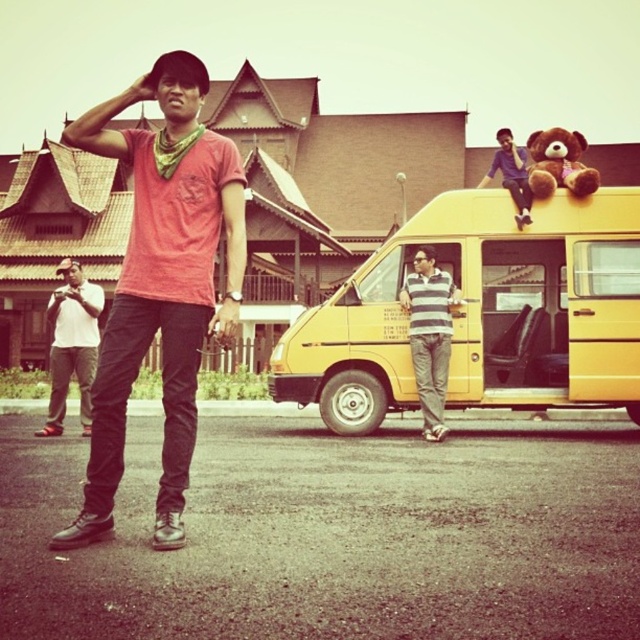
Does point (115, 349) lie behind point (534, 170)?

That is False.

Which is above, matte red t-shirt at center or brown plush bear at upper right?

Positioned higher is brown plush bear at upper right.

The width and height of the screenshot is (640, 640). Describe the element at coordinates (161, 284) in the screenshot. I see `matte red t-shirt at center` at that location.

At what (x,y) coordinates should I click in order to perform the action: click on matte red t-shirt at center. Please return your answer as a coordinate pair (x, y). The width and height of the screenshot is (640, 640). Looking at the image, I should click on (161, 284).

Who is more forward, (412, 349) or (554, 179)?

Point (412, 349) is in front.

Can you confirm if striped fabric shirt at center is bigger than brown plush bear at upper right?

No.

Is point (435, 333) closer to camera compared to point (582, 180)?

That is True.

This screenshot has width=640, height=640. Identify the location of striped fabric shirt at center. (429, 336).

Is point (556, 221) positioned after point (65, 372)?

No, it is in front of (65, 372).

Who is higher up, yellow matte van at center or white matte shirt at left?

yellow matte van at center is higher up.

I want to click on yellow matte van at center, so click(483, 314).

What are the coordinates of `yellow matte van at center` in the screenshot? It's located at (483, 314).